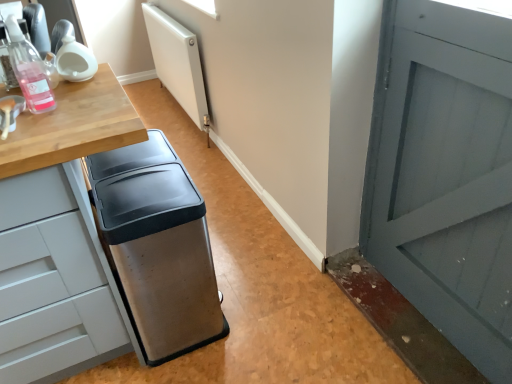
You are a GUI agent. You are given a task and a screenshot of the screen. Output one action in this format:
    pyautogui.click(x=<x>, y=<y>)
    Task: Click on the free spot to the right of stainless steel trash can at center
    
    Given the screenshot: What is the action you would take?
    pyautogui.click(x=266, y=293)